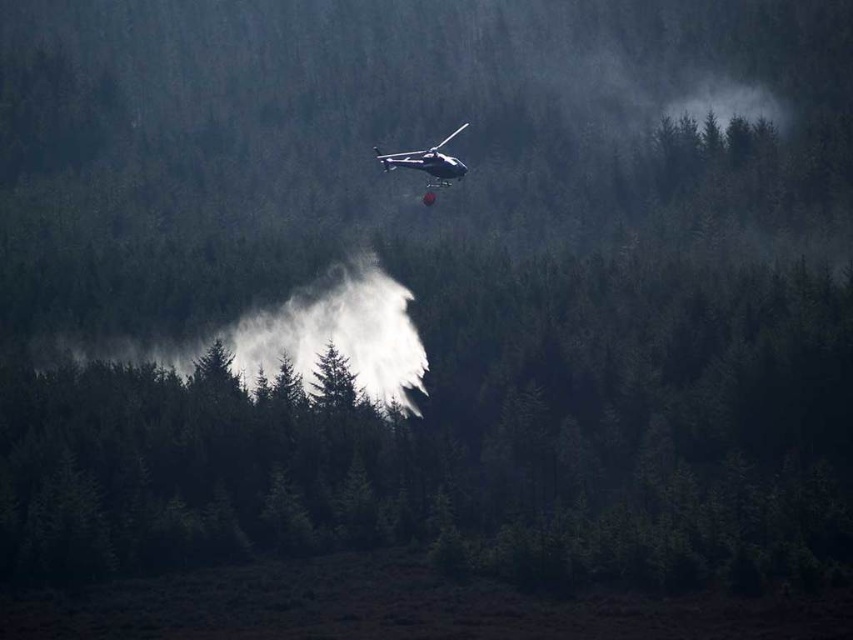
You are a pilot flying a metallic silver helicopter at center. You notice white matte smoke at center in the same area. Can you determine if the smoke is larger than your helicopter?

The white matte smoke at center is larger in size than the metallic silver helicopter at center, so yes, the smoke is larger than the helicopter.